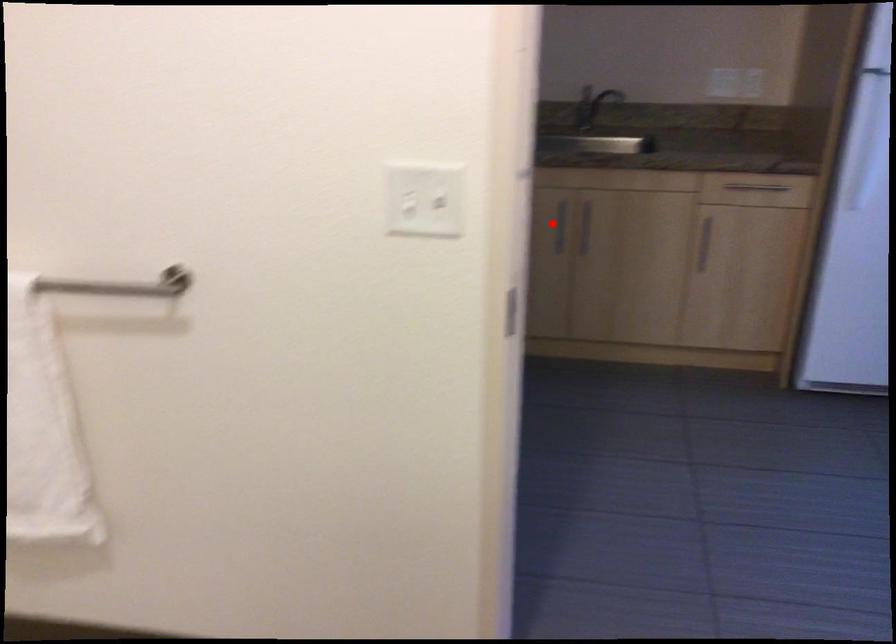
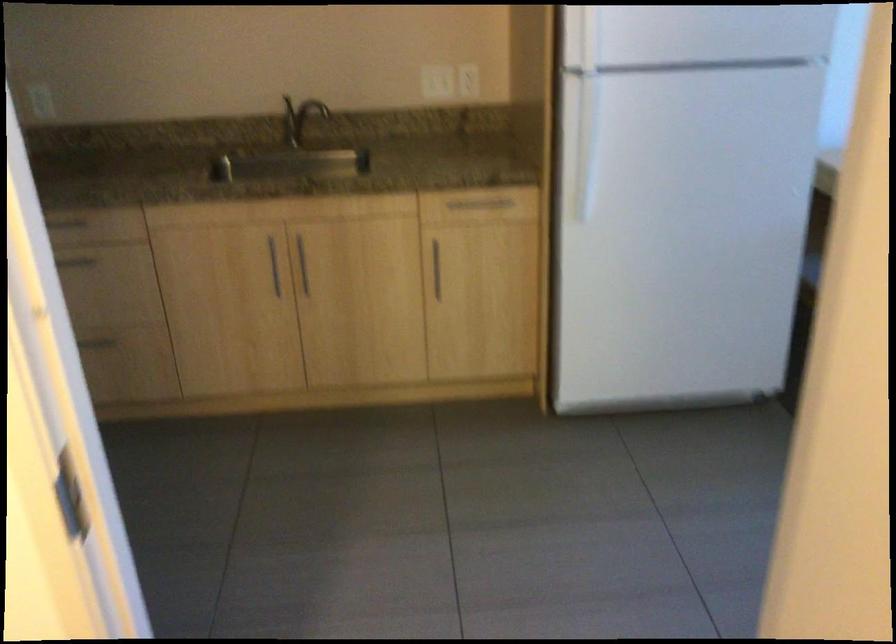
Locate, in the second image, the point that corresponds to the highlighted location in the first image.

(273, 265)